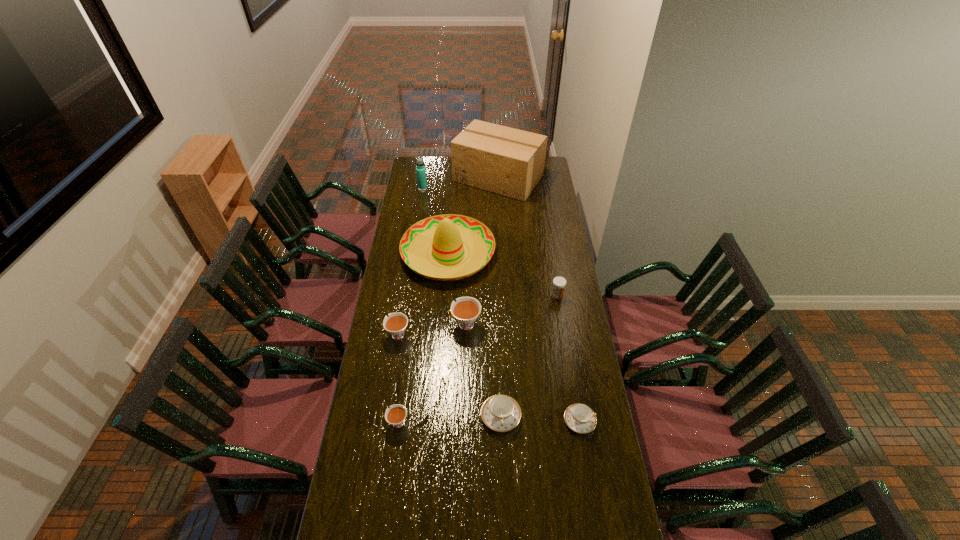
The width and height of the screenshot is (960, 540). I want to click on teacup that is the fifth closest to the thermos bottle, so click(x=580, y=418).

Locate an element on the screen. This screenshot has height=540, width=960. teacup that is the fourth nearest to the box is located at coordinates (580, 418).

Find the location of a particular element. The height and width of the screenshot is (540, 960). white teacup that is the closest to the box is located at coordinates (465, 310).

In order to click on the closest white teacup to the second biggest white teacup in this screenshot , I will do `click(465, 310)`.

Choose which blue teacup is the nearest neighbor to the nearest white teacup. Please provide its 2D coordinates. Your answer should be formatted as a tuple, i.e. [(x, y)], where the tuple contains the x and y coordinates of a point satisfying the conditions above.

[(501, 413)]

Identify the location of free location that satisfies the following two spatial constraints: 1. on the front side of the thermos bottle; 2. on the side of the second smallest white teacup with the handle. 400,335.